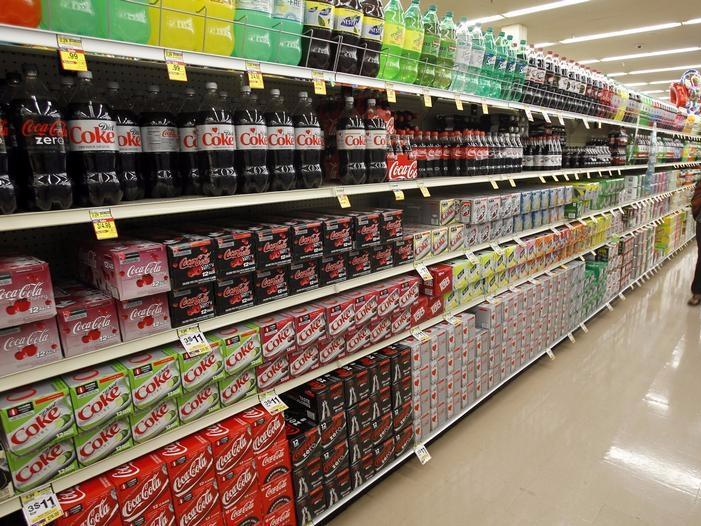
You are a GUI agent. You are given a task and a screenshot of the screen. Output one action in this format:
    pyautogui.click(x=<x>, y=<y>)
    Task: Click on the bottles of diet dr pepper
    The image size is (701, 526).
    Given the screenshot: What is the action you would take?
    pyautogui.click(x=531, y=74), pyautogui.click(x=542, y=74), pyautogui.click(x=529, y=155), pyautogui.click(x=536, y=155), pyautogui.click(x=550, y=160), pyautogui.click(x=554, y=155), pyautogui.click(x=559, y=151)